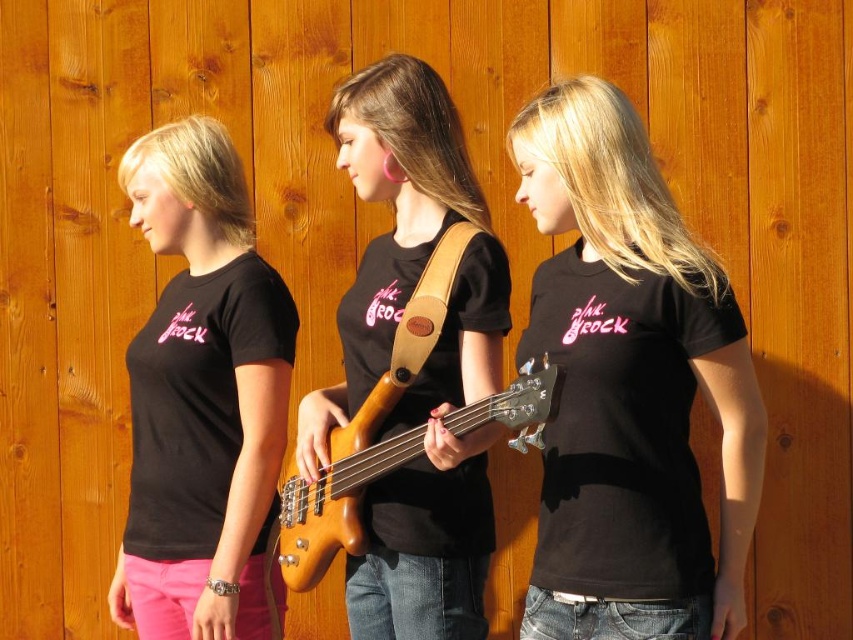
Question: Is matte black t-shirt at center smaller than light brown wood guitar at center?

Choices:
 (A) no
 (B) yes

Answer: (A)

Question: Does black matte t-shirt at center have a larger size compared to matte black t-shirt at center?

Choices:
 (A) yes
 (B) no

Answer: (B)

Question: Which object is the farthest from the black matte t-shirt at center?

Choices:
 (A) matte black t-shirt at center
 (B) black matte t-shirt at left
 (C) light brown wood guitar at center

Answer: (B)

Question: Does black matte t-shirt at center appear under black matte t-shirt at left?

Choices:
 (A) no
 (B) yes

Answer: (A)

Question: Which of the following is the farthest from the observer?

Choices:
 (A) (415, 515)
 (B) (527, 369)

Answer: (A)

Question: Which object is positioned farthest from the black matte t-shirt at left?

Choices:
 (A) black matte t-shirt at center
 (B) light brown wood guitar at center
 (C) matte black t-shirt at center

Answer: (A)